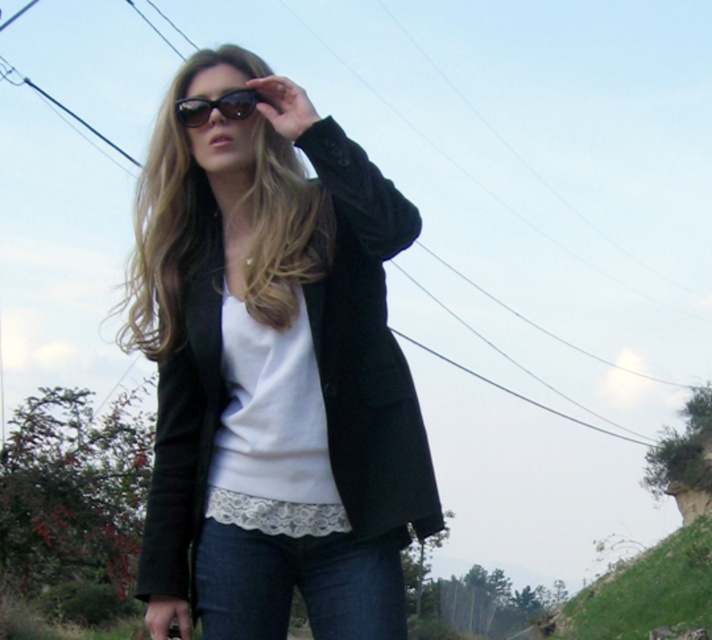
Which is in front, point (340, 212) or point (319, 636)?

Point (319, 636) is in front.

Is point (206, 387) positioned before point (337, 632)?

No.

Find the location of a particular element. The height and width of the screenshot is (640, 712). black velvet jacket at center is located at coordinates (366, 348).

Who is lower down, denim jeans at lower center or black plastic sunglasses at upper center?

denim jeans at lower center

Is denim jeans at lower center to the right of black plastic sunglasses at upper center from the viewer's perspective?

Indeed, denim jeans at lower center is positioned on the right side of black plastic sunglasses at upper center.

At what (x,y) coordinates should I click in order to perform the action: click on denim jeans at lower center. Please return your answer as a coordinate pair (x, y). The image size is (712, 640). Looking at the image, I should click on (298, 582).

What are the coordinates of `denim jeans at lower center` in the screenshot? It's located at (298, 582).

Is black velvet jacket at center above black plastic sunglasses at upper center?

No, black velvet jacket at center is not above black plastic sunglasses at upper center.

Does point (397, 220) come behind point (194, 115)?

No, (397, 220) is closer to viewer.

Which is behind, point (192, 573) or point (192, 97)?

The point (192, 97) is behind.

This screenshot has height=640, width=712. Find the location of `black velvet jacket at center`. black velvet jacket at center is located at coordinates (366, 348).